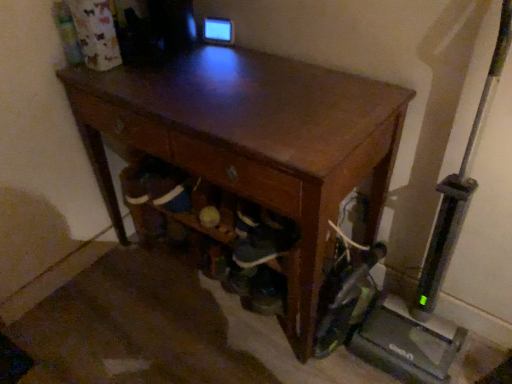
Question: Relative to shiny brown desk at center, is wooden drawer at center in front or behind?

Choices:
 (A) front
 (B) behind

Answer: (B)

Question: From the image's perspective, is wooden drawer at center above or below shiny brown desk at center?

Choices:
 (A) above
 (B) below

Answer: (A)

Question: From a real-world perspective, relative to shiny brown desk at center, is wooden drawer at center vertically above or below?

Choices:
 (A) above
 (B) below

Answer: (A)

Question: From a real-world perspective, is shiny brown desk at center physically located above or below wooden drawer at center?

Choices:
 (A) above
 (B) below

Answer: (B)

Question: Would you say shiny brown desk at center is inside or outside wooden drawer at center?

Choices:
 (A) inside
 (B) outside

Answer: (B)

Question: Considering the positions of shiny brown desk at center and wooden drawer at center in the image, is shiny brown desk at center wider or thinner than wooden drawer at center?

Choices:
 (A) thin
 (B) wide

Answer: (B)

Question: Is point (242, 148) closer or farther from the camera than point (179, 139)?

Choices:
 (A) closer
 (B) farther

Answer: (A)